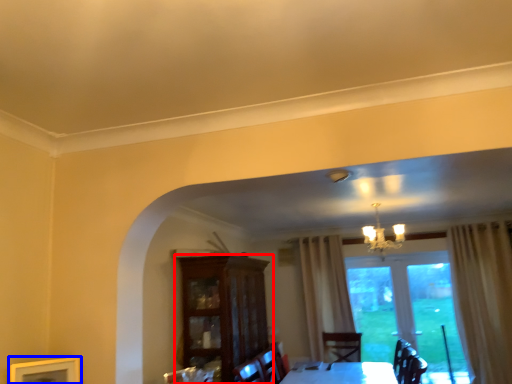
Question: Which point is further to the camera, cabinetry (highlighted by a red box) or picture frame (highlighted by a blue box)?

Choices:
 (A) cabinetry
 (B) picture frame

Answer: (A)